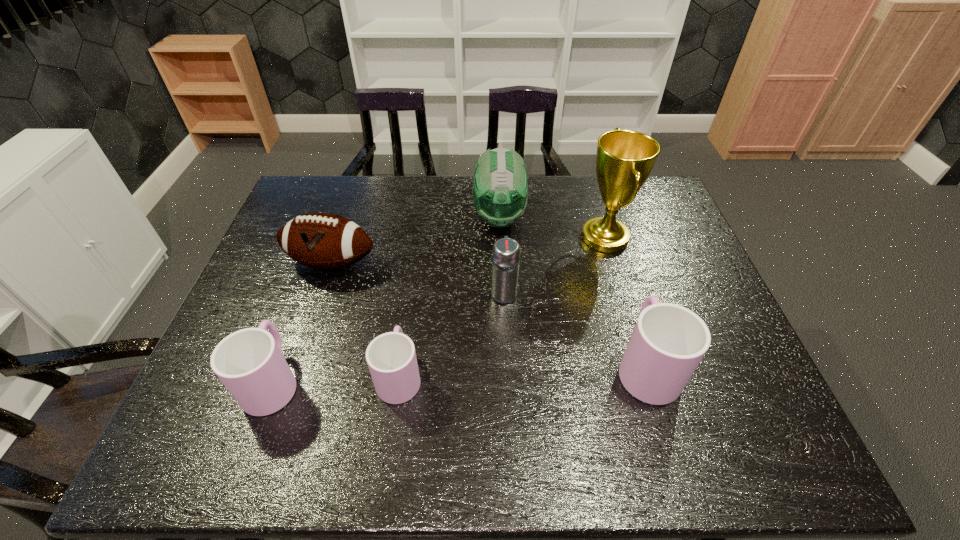
Locate an element on the screen. free point that satisfies the following two spatial constraints: 1. by the handles of the award; 2. on the front side of the football (American) is located at coordinates (612, 263).

In order to click on vacant space that satisfies the following two spatial constraints: 1. with the handle on the side of the football (American); 2. on the left side of the second shortest cup in this screenshot , I will do `click(317, 263)`.

Find the location of a particular element. free space that satisfies the following two spatial constraints: 1. by the handles of the tallest object; 2. with the handle on the side of the rightmost cup is located at coordinates (643, 365).